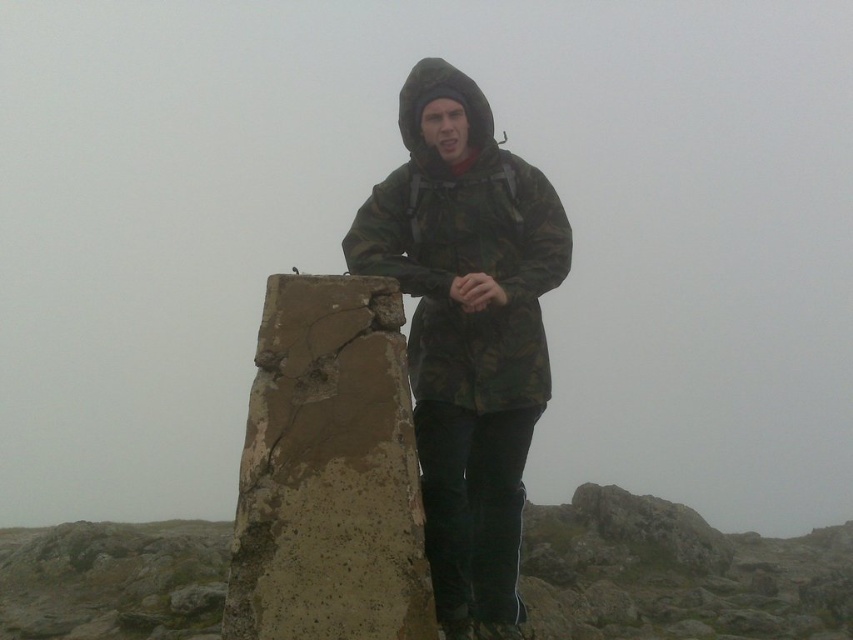
Question: Is brown concrete block at center behind camo fabric jacket at center?

Choices:
 (A) no
 (B) yes

Answer: (A)

Question: Where is brown concrete block at center located in relation to camo fabric jacket at center in the image?

Choices:
 (A) left
 (B) right

Answer: (A)

Question: Is brown concrete block at center in front of camo fabric jacket at center?

Choices:
 (A) no
 (B) yes

Answer: (B)

Question: Which point is closer to the camera?

Choices:
 (A) brown concrete block at center
 (B) camo fabric jacket at center

Answer: (A)

Question: Among these points, which one is nearest to the camera?

Choices:
 (A) (347, 486)
 (B) (525, 342)

Answer: (A)